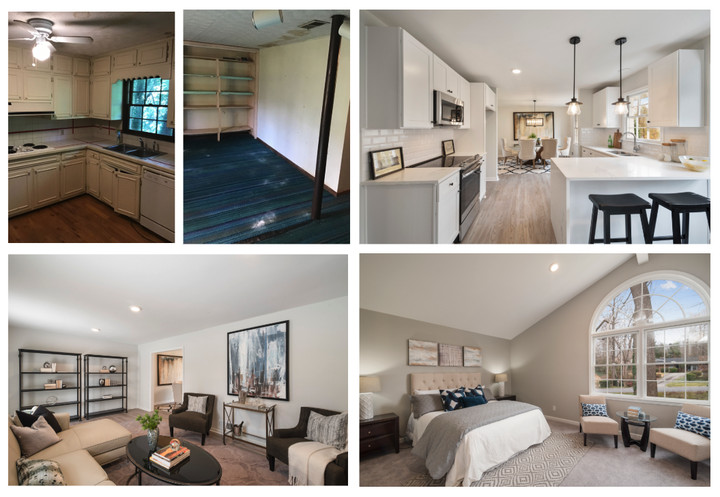
At what (x,y) coordinates should I click in order to perform the action: click on rooms in a house. Please return your answer as a coordinate pair (x, y). This screenshot has height=497, width=720. Looking at the image, I should click on (96, 171), (283, 185), (505, 203), (540, 400), (216, 396).